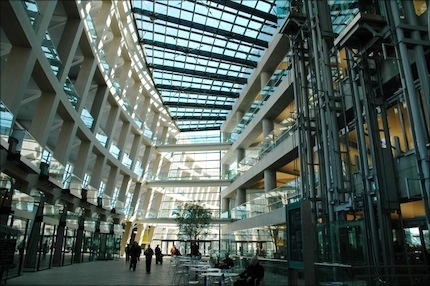
You are a GUI agent. You are given a task and a screenshot of the screen. Output one action in this format:
    pyautogui.click(x=<x>, y=<y>)
    Task: Click on the chair
    The width and height of the screenshot is (430, 286).
    Given the screenshot: What is the action you would take?
    pyautogui.click(x=193, y=283)